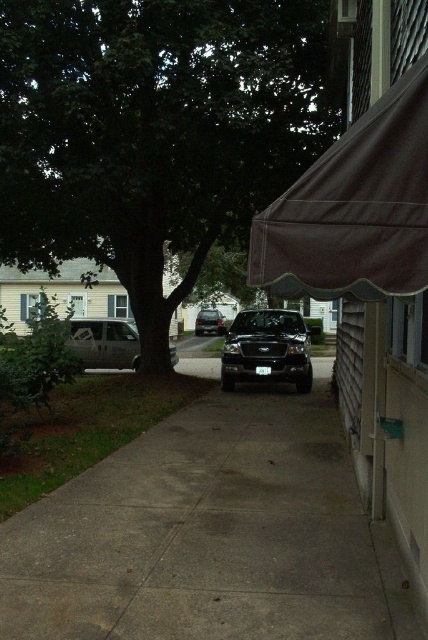
You are a delivery person needing to park your 3.5 meter long van between the black matte truck at center and the shiny black suv at center. Can you fit your van in the space between them without overlapping either vehicle?

The distance between the black matte truck at center and the shiny black suv at center is 7.23 meters. Since your van is 3.5 meters long, there is sufficient space to park it between them without overlapping either vehicle.

You are a delivery person trying to navigate a narrow sidewalk. You see a green leafy tree at center and a shiny black suv at center. Which object takes up more space on the sidewalk?

The green leafy tree at center is larger in size than the shiny black suv at center, so the tree takes up more space on the sidewalk.